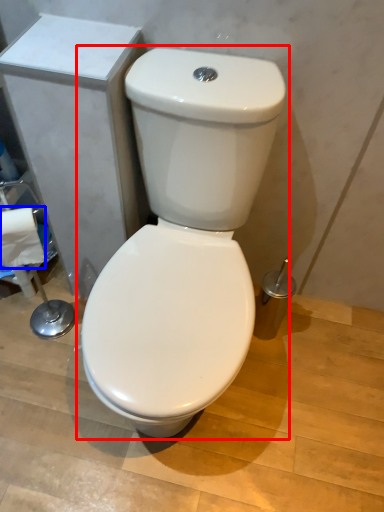
Question: Which point is closer to the camera, toilet (highlighted by a red box) or toilet paper (highlighted by a blue box)?

Choices:
 (A) toilet
 (B) toilet paper

Answer: (A)